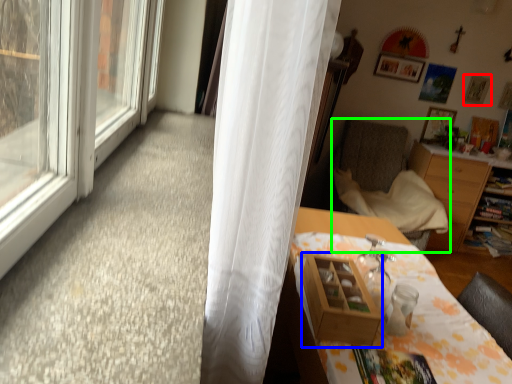
Question: Considering the real-world distances, which object is farthest from picture frame (highlighted by a red box)? shelf (highlighted by a blue box) or chair (highlighted by a green box)?

Choices:
 (A) shelf
 (B) chair

Answer: (A)